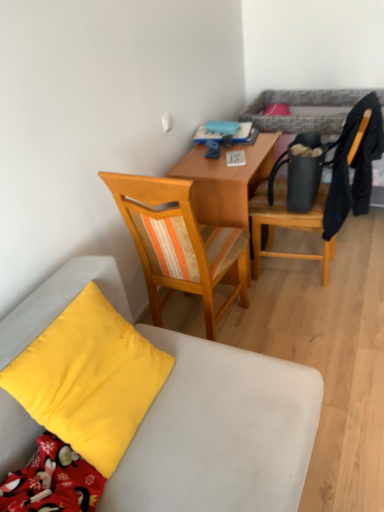
In order to click on free spot in front of matte black chair at upper right, the first chair in the right-to-left sequence in this screenshot , I will do `click(306, 318)`.